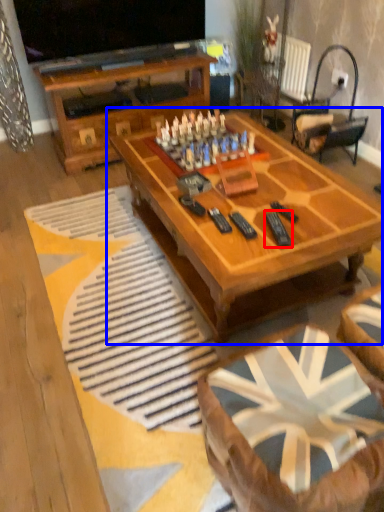
Question: Which object appears farthest to the camera in this image, remote (highlighted by a red box) or coffee table (highlighted by a blue box)?

Choices:
 (A) remote
 (B) coffee table

Answer: (A)